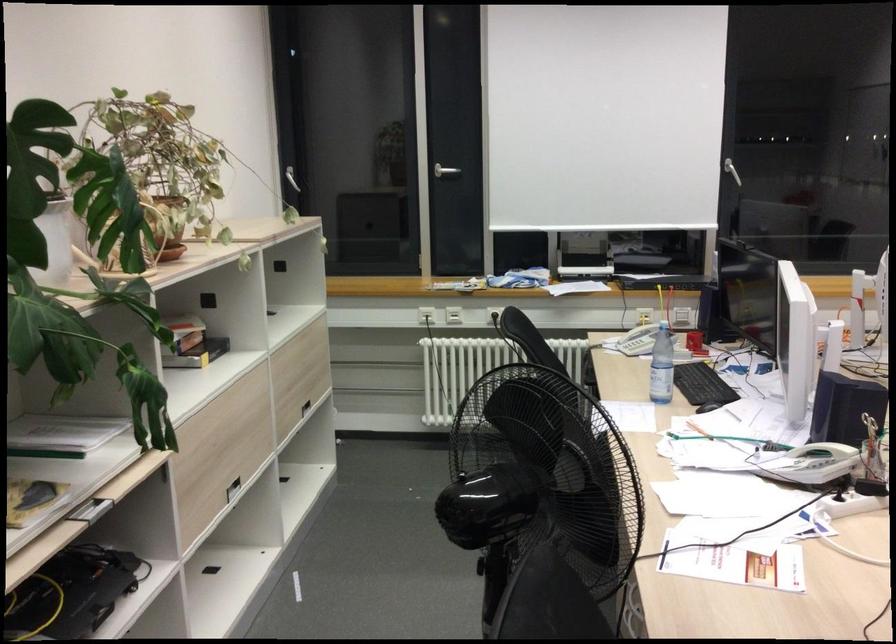
The location [661,366] corresponds to which object?

It refers to a plastic water bottle.